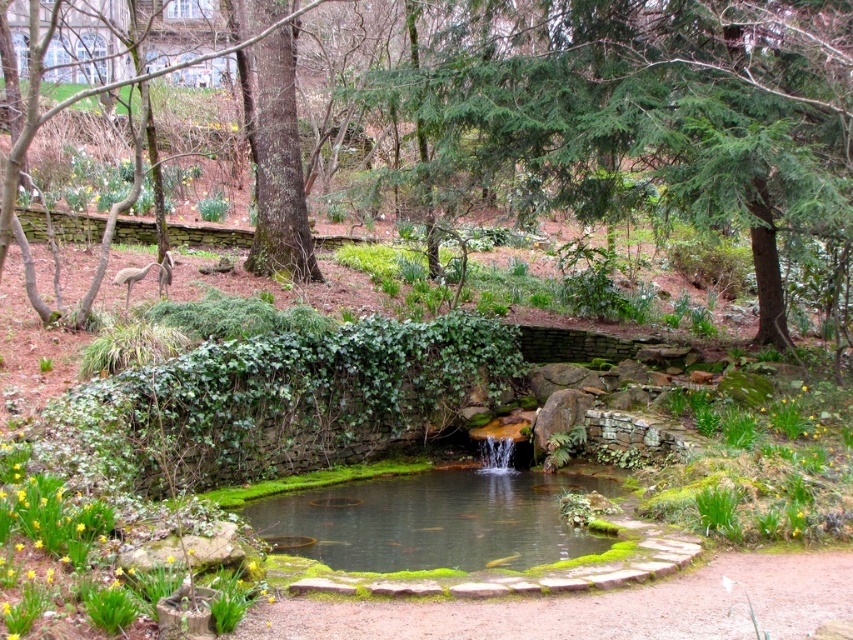
Question: Is green leafy tree at center smaller than clear water at pond center?

Choices:
 (A) yes
 (B) no

Answer: (B)

Question: Which of the following is the closest to the observer?

Choices:
 (A) (321, 522)
 (B) (662, 140)

Answer: (A)

Question: Is green leafy tree at center positioned behind clear water at pond center?

Choices:
 (A) no
 (B) yes

Answer: (A)

Question: Is green leafy tree at center thinner than clear water at pond center?

Choices:
 (A) no
 (B) yes

Answer: (A)

Question: Among these objects, which one is farthest from the camera?

Choices:
 (A) clear water at pond center
 (B) green leafy tree at center

Answer: (A)